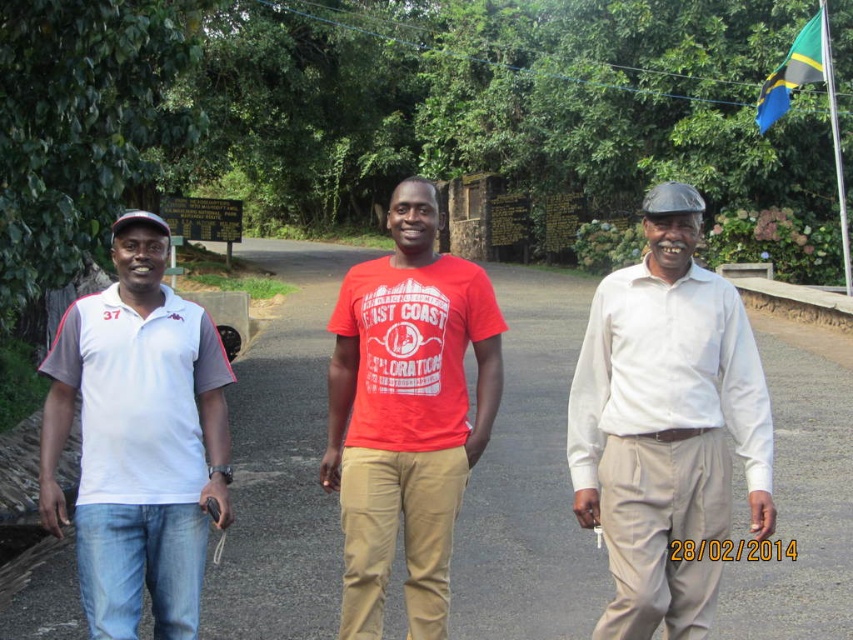
You are standing at the center of the image and want to locate the khaki cotton pants at right. In which direction should you look relative to your current position?

You should look to the right relative to your current position at the center of the image to locate the khaki cotton pants at right.

In the scene shown: You are a photographer trying to capture a group photo of the white cotton polo shirt at left and the matte khaki pants at center. Since you want to ensure both subjects are in the frame, which direction should you position your camera relative to the subjects?

The white cotton polo shirt at left is positioned on the left side of matte khaki pants at center. To capture both in the frame, position the camera to the right side of the matte khaki pants at center so that the white cotton polo shirt at left is included on the left side of the frame.

You are a photographer trying to capture a group photo of the khaki cotton pants at right and the matte khaki pants at center. Which person should stand closer to the camera to ensure both appear equally tall in the photo?

The khaki cotton pants at right is shorter than the matte khaki pants at center, so the khaki cotton pants at right should stand closer to the camera to appear taller and balance their sizes in the photo.